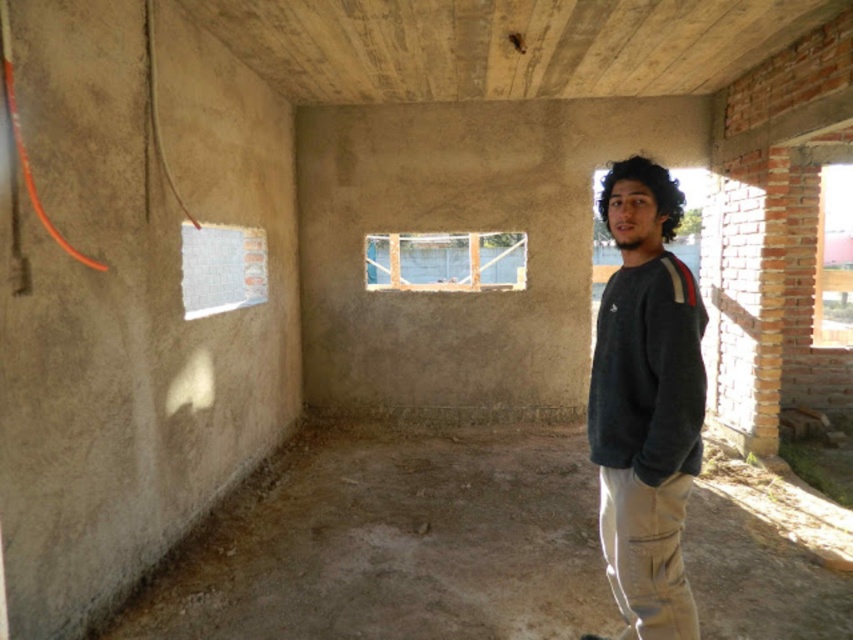
Question: Which object appears farthest from the camera in this image?

Choices:
 (A) khaki pants at lower right
 (B) dark gray sweater at center
 (C) dark gray fleece sweatshirt at right

Answer: (A)

Question: Which point is farther to the camera?

Choices:
 (A) (624, 355)
 (B) (630, 496)

Answer: (A)

Question: Among these points, which one is farthest from the camera?

Choices:
 (A) (601, 198)
 (B) (611, 316)
 (C) (619, 604)
 (D) (657, 458)

Answer: (C)

Question: Does dark gray sweater at center appear over dark curly hair at upper right?

Choices:
 (A) no
 (B) yes

Answer: (A)

Question: Is dark gray sweater at center behind khaki pants at lower right?

Choices:
 (A) yes
 (B) no

Answer: (B)

Question: Is khaki pants at lower right positioned behind dark curly hair at upper right?

Choices:
 (A) yes
 (B) no

Answer: (B)